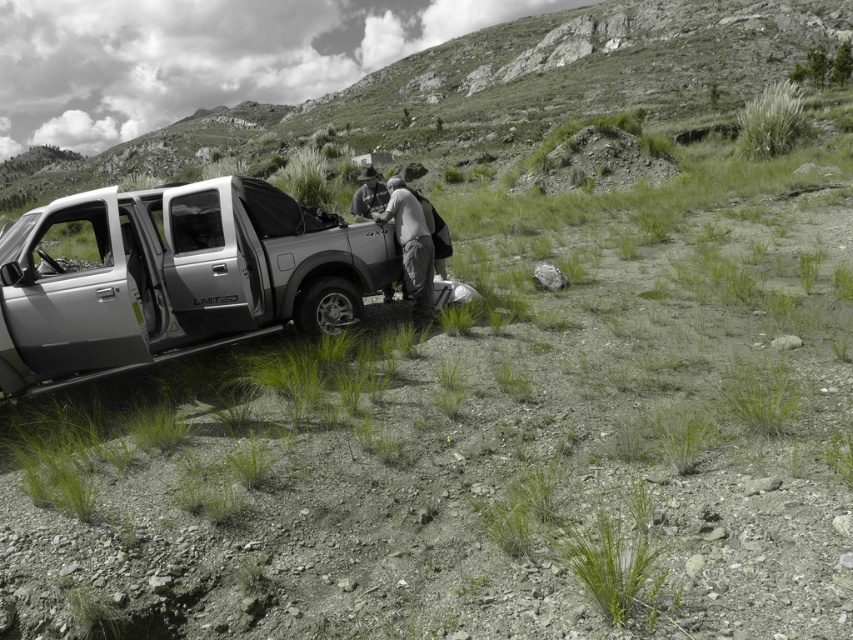
Question: Which point is farther from the camera taking this photo?

Choices:
 (A) (412, 248)
 (B) (308, 266)

Answer: (A)

Question: Is satin silver truck at left wider than gray fabric jacket at center?

Choices:
 (A) no
 (B) yes

Answer: (B)

Question: Considering the relative positions of satin silver truck at left and gray fabric jacket at center in the image provided, where is satin silver truck at left located with respect to gray fabric jacket at center?

Choices:
 (A) left
 (B) right

Answer: (A)

Question: Is the position of satin silver truck at left less distant than that of gray fabric jacket at center?

Choices:
 (A) yes
 (B) no

Answer: (A)

Question: Among these objects, which one is nearest to the camera?

Choices:
 (A) gray fabric jacket at center
 (B) satin silver truck at left

Answer: (B)